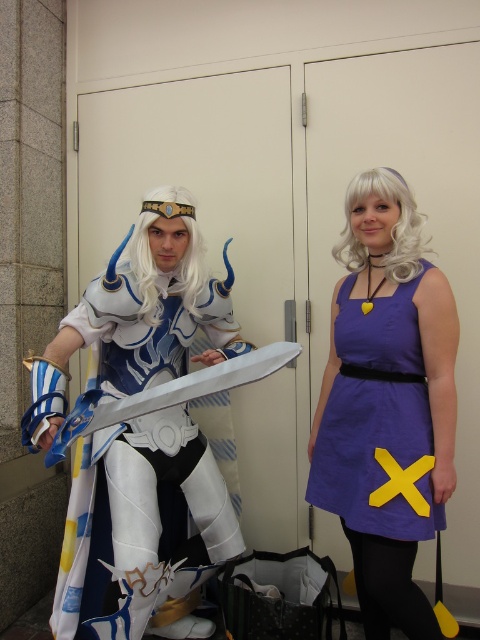
Is purple fabric dress at center further to camera compared to white glossy armor at center?

Yes, it is.

Between point (384, 260) and point (101, 516), which one is positioned behind?

Point (101, 516)

You are a GUI agent. You are given a task and a screenshot of the screen. Output one action in this format:
    pyautogui.click(x=<x>, y=<y>)
    Task: Click on the purple fabric dress at center
    This screenshot has height=640, width=480.
    Given the screenshot: What is the action you would take?
    pyautogui.click(x=386, y=403)